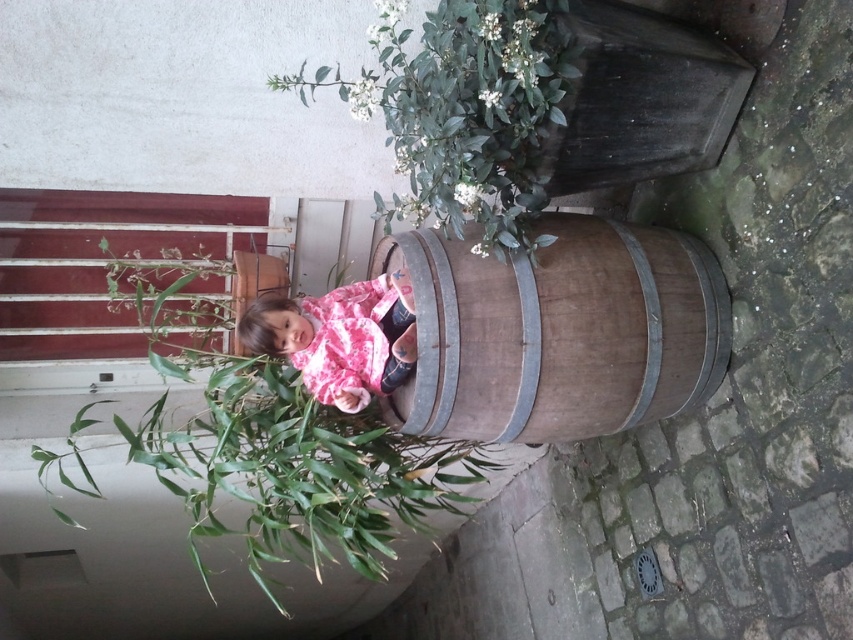
You are a photographer trying to capture a photo of the brown wooden barrel at center and the pink cotton shirt at center. Since you want both objects to appear equally prominent in the photo, which object should you zoom in on more?

The brown wooden barrel at center is larger in size than the pink cotton shirt at center, so you should zoom in more on the pink cotton shirt at center to balance their prominence in the photo.